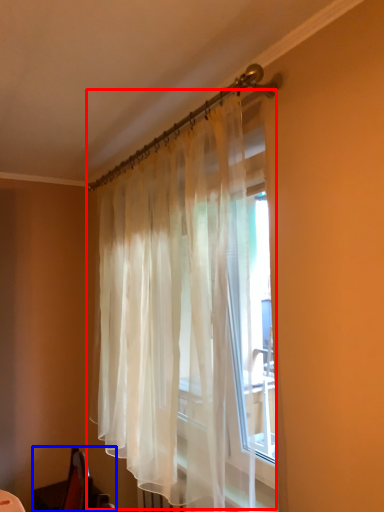
Question: Which object is further to the camera taking this photo, curtain (highlighted by a red box) or swivel chair (highlighted by a blue box)?

Choices:
 (A) curtain
 (B) swivel chair

Answer: (B)